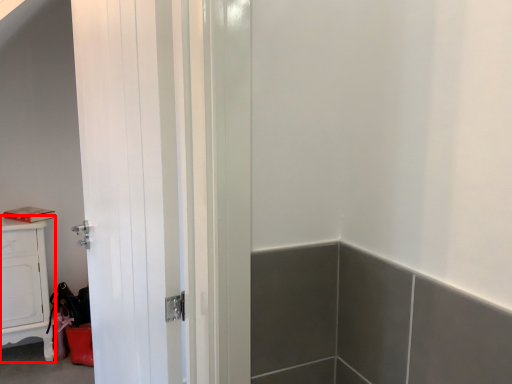
Question: From the image's perspective, considering the relative positions of cabinetry (annotated by the red box) and door in the image provided, where is cabinetry (annotated by the red box) located with respect to the staircase?

Choices:
 (A) below
 (B) above

Answer: (A)